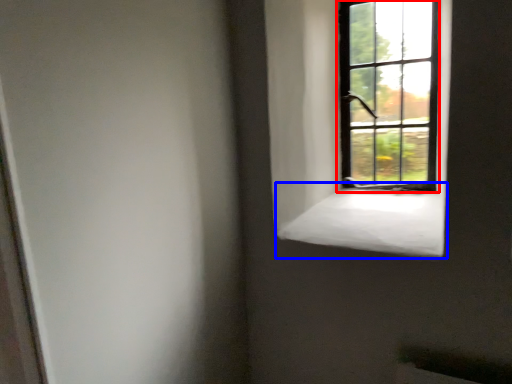
Question: Among these objects, which one is nearest to the camera, window (highlighted by a red box) or window sill (highlighted by a blue box)?

Choices:
 (A) window
 (B) window sill

Answer: (B)